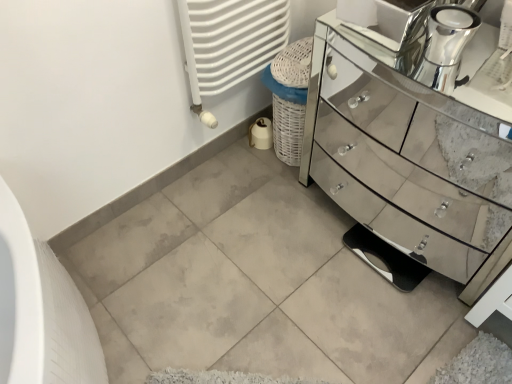
Question: Does mirror-finished glass chest of drawers at right have a greater height compared to chrome metallic faucet at upper right?

Choices:
 (A) no
 (B) yes

Answer: (B)

Question: From a real-world perspective, is mirror-finished glass chest of drawers at right physically below chrome metallic faucet at upper right?

Choices:
 (A) no
 (B) yes

Answer: (B)

Question: Is mirror-finished glass chest of drawers at right positioned before chrome metallic faucet at upper right?

Choices:
 (A) no
 (B) yes

Answer: (B)

Question: Is mirror-finished glass chest of drawers at right with chrome metallic faucet at upper right?

Choices:
 (A) no
 (B) yes

Answer: (A)

Question: Is mirror-finished glass chest of drawers at right surrounding chrome metallic faucet at upper right?

Choices:
 (A) no
 (B) yes

Answer: (A)

Question: Is mirror-finished glass chest of drawers at right far away from chrome metallic faucet at upper right?

Choices:
 (A) yes
 (B) no

Answer: (B)

Question: Could you tell me if white textured radiator at upper center is turned towards chrome metallic faucet at upper right?

Choices:
 (A) yes
 (B) no

Answer: (A)

Question: Can you confirm if white textured radiator at upper center is bigger than chrome metallic faucet at upper right?

Choices:
 (A) yes
 (B) no

Answer: (A)

Question: Considering the relative positions of white textured radiator at upper center and chrome metallic faucet at upper right in the image provided, is white textured radiator at upper center in front of chrome metallic faucet at upper right?

Choices:
 (A) no
 (B) yes

Answer: (A)

Question: From the image's perspective, would you say white textured radiator at upper center is positioned over chrome metallic faucet at upper right?

Choices:
 (A) no
 (B) yes

Answer: (B)

Question: Considering the relative positions of white textured radiator at upper center and chrome metallic faucet at upper right in the image provided, is white textured radiator at upper center behind chrome metallic faucet at upper right?

Choices:
 (A) no
 (B) yes

Answer: (B)

Question: Is white textured radiator at upper center far away from chrome metallic faucet at upper right?

Choices:
 (A) no
 (B) yes

Answer: (A)

Question: Is the position of mirror-finished glass chest of drawers at right less distant than that of white textured radiator at upper center?

Choices:
 (A) no
 (B) yes

Answer: (B)